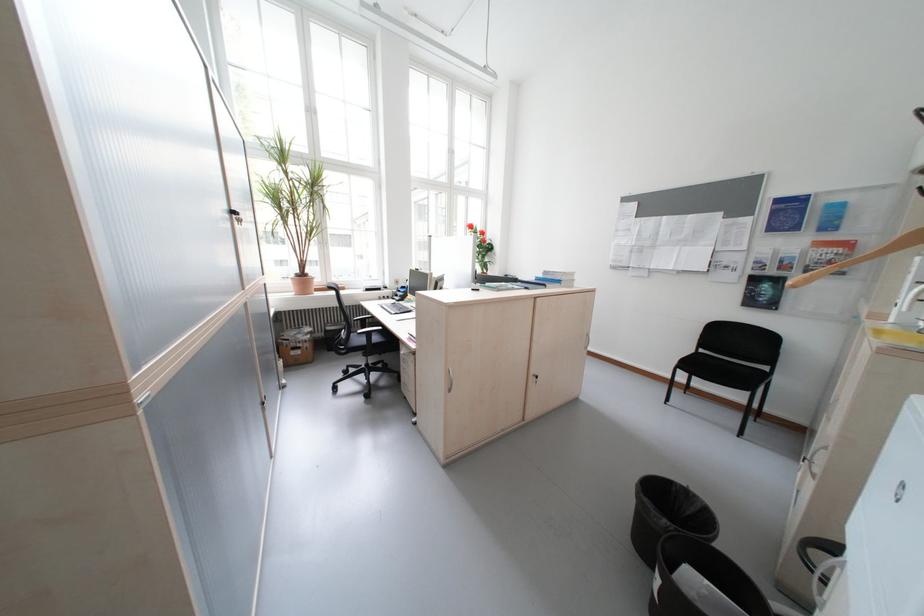
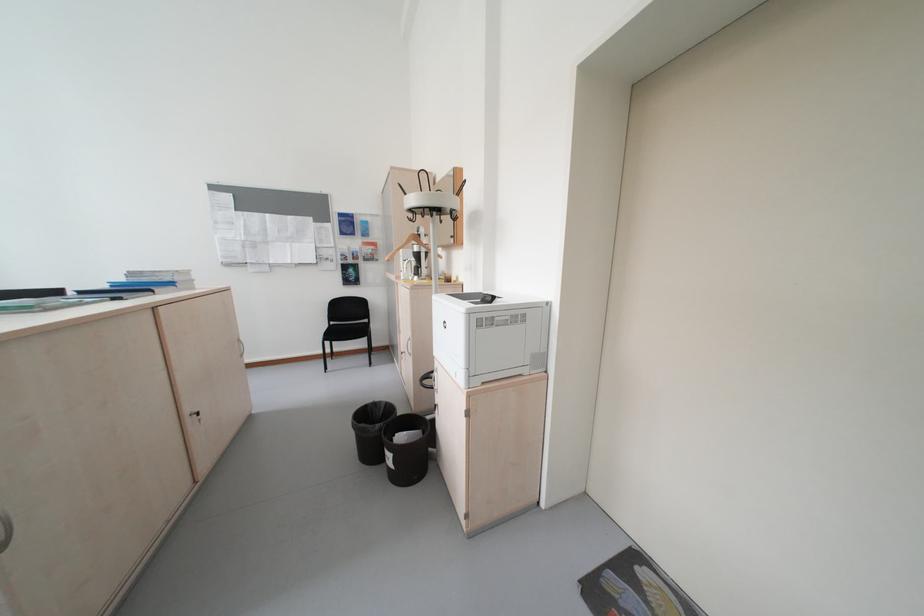
Locate, in the second image, the point that corresponds to the point at 707,498 in the first image.

(391, 403)